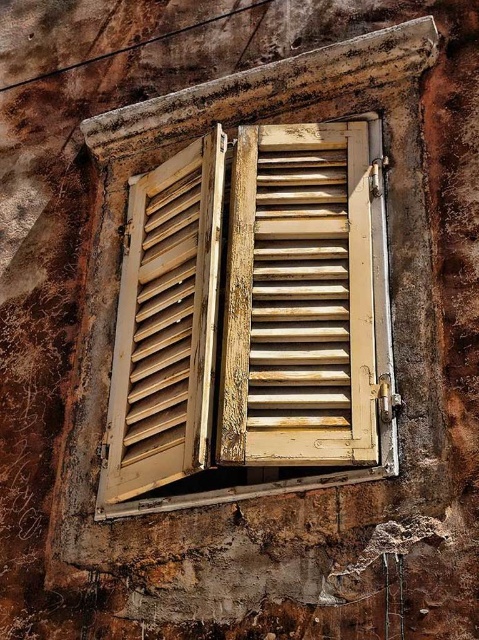
Question: Does wooden shutters at center have a greater width compared to wooden slats at center?

Choices:
 (A) no
 (B) yes

Answer: (B)

Question: Does wooden shutters at center have a smaller size compared to wooden slats at center?

Choices:
 (A) yes
 (B) no

Answer: (B)

Question: Is wooden shutters at center to the right of wooden slats at center from the viewer's perspective?

Choices:
 (A) yes
 (B) no

Answer: (A)